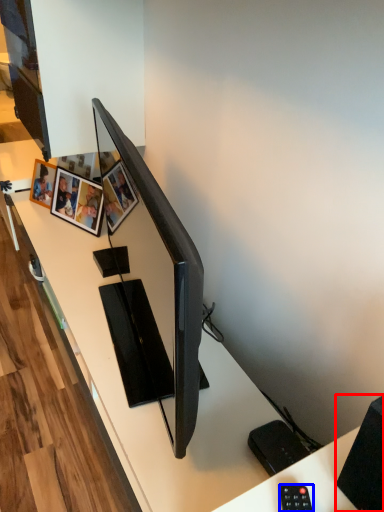
Question: Which object appears farthest to the camera in this image, speaker (highlighted by a red box) or control (highlighted by a blue box)?

Choices:
 (A) speaker
 (B) control

Answer: (B)